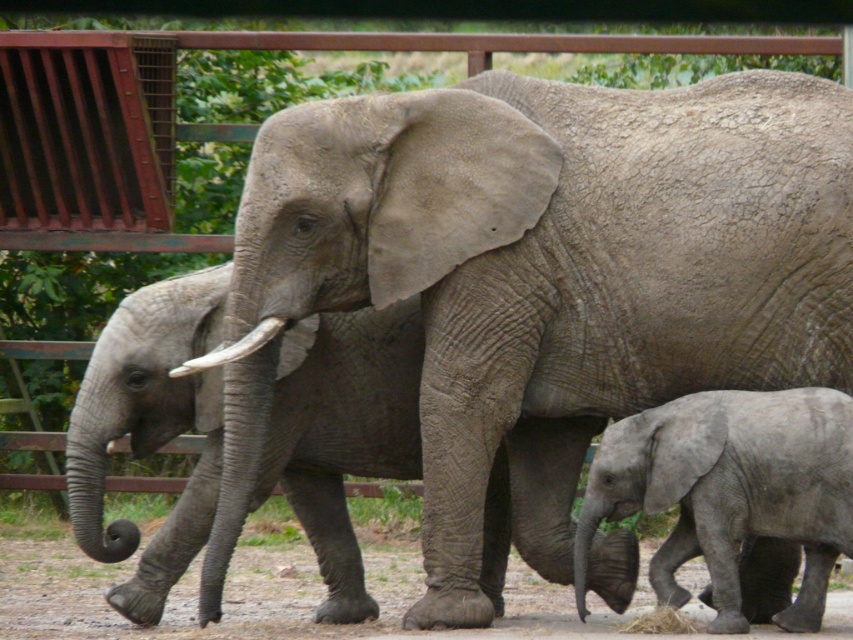
You are a zookeeper who needs to determine which elephant requires more space in their enclosure. Based on the image, which elephant between the gray rough elephant at center and the gray matte elephant at lower right should be allocated more space?

The gray rough elephant at center is larger in size than the gray matte elephant at lower right, so it should be allocated more space in the enclosure.

Based on the coordinates provided, which object corresponds to the point at location (149, 428)?

The gray wrinkled elephant at center corresponds to the point at location 0.676, 0.176.

You are a zookeeper trying to count the elephants in the enclosure. You can see the gray wrinkled elephant at center and the gray matte elephant at lower right. Which one is closer to you?

The gray wrinkled elephant at center is closer to you because the gray matte elephant at lower right is behind it.